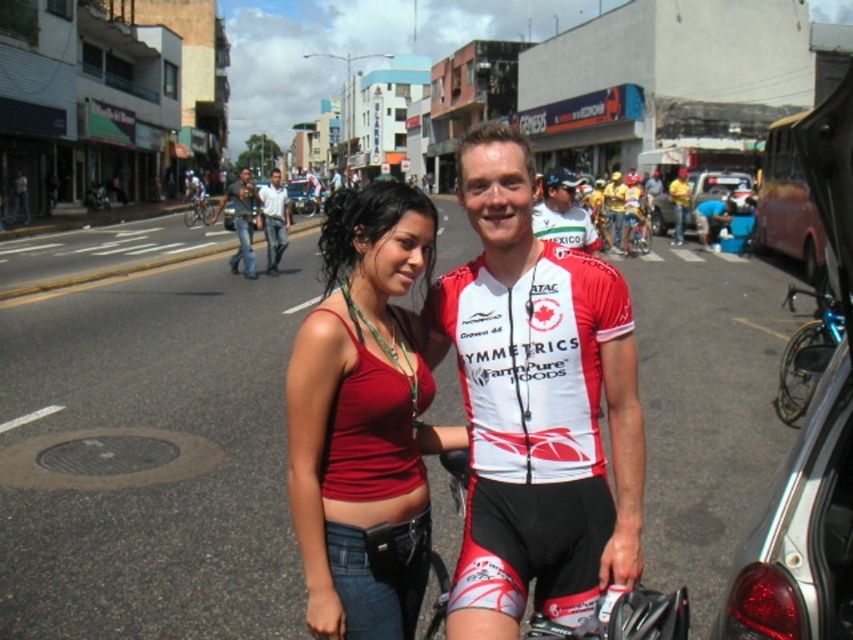
Measure the distance between point (392, 308) and camera.

Point (392, 308) is 7.70 feet away from camera.

Between matte red tank top at center and dark gray jeans at center, which one has less height?

matte red tank top at center

Does point (341, 426) come closer to viewer compared to point (230, 268)?

Yes, it is.

At what (x,y) coordinates should I click in order to perform the action: click on matte red tank top at center. Please return your answer as a coordinate pair (x, y). Looking at the image, I should click on (364, 419).

Does shiny metallic bicycle at right have a greater height compared to black matte bicycle helmet at center?

No.

Can you confirm if shiny metallic bicycle at right is positioned to the left of black matte bicycle helmet at center?

Correct, you'll find shiny metallic bicycle at right to the left of black matte bicycle helmet at center.

In the scene shown: Who is more distant from viewer, (840, 316) or (556, 173)?

The point (556, 173) is behind.

I want to click on shiny metallic bicycle at right, so click(805, 355).

Does blue metallic bicycle at center appear on the right side of silver metallic bicycle at center?

Yes, blue metallic bicycle at center is to the right of silver metallic bicycle at center.

Who is more forward, (646, 250) or (210, 216)?

Point (646, 250) is more forward.

Locate an element on the screen. The image size is (853, 640). blue metallic bicycle at center is located at coordinates (635, 230).